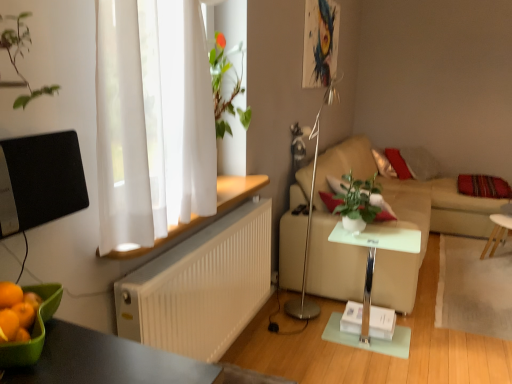
The width and height of the screenshot is (512, 384). What do you see at coordinates (359, 202) in the screenshot?
I see `green glossy houseplant at center` at bounding box center [359, 202].

Image resolution: width=512 pixels, height=384 pixels. What are the coordinates of `white wood window sill at lower left` in the screenshot? It's located at (237, 190).

The image size is (512, 384). Identify the location of green glossy houseplant at center. (359, 202).

Is beige fabric couch at right to the left or to the right of white ribbed radiator at lower left in the image?

beige fabric couch at right is positioned on white ribbed radiator at lower left's right side.

From the image's perspective, who appears lower, beige fabric couch at right or white ribbed radiator at lower left?

From the image's view, white ribbed radiator at lower left is below.

Considering the relative sizes of beige fabric couch at right and white ribbed radiator at lower left in the image provided, is beige fabric couch at right shorter than white ribbed radiator at lower left?

No.

Can we say beige fabric couch at right lies outside white ribbed radiator at lower left?

Yes, beige fabric couch at right is not within white ribbed radiator at lower left.

Is striped fabric pillow at right thinner than white glossy side table at center, marked as the 2th table in a right-to-left arrangement?

No.

Who is more distant, striped fabric pillow at right or white glossy side table at center, marked as the 2th table in a back-to-front arrangement?

Positioned behind is striped fabric pillow at right.

Is striped fabric pillow at right bigger or smaller than white glossy side table at center, marked as the 1th table in a front-to-back arrangement?

Considering their sizes, striped fabric pillow at right takes up less space than white glossy side table at center, marked as the 1th table in a front-to-back arrangement.

Considering the positions of objects green glossy houseplant at center and silver metallic floor lamp at center in the image provided, who is in front, green glossy houseplant at center or silver metallic floor lamp at center?

Positioned in front is silver metallic floor lamp at center.

The width and height of the screenshot is (512, 384). I want to click on lamp in front of the green glossy houseplant at center, so (x=311, y=216).

Considering the relative sizes of green glossy houseplant at center and silver metallic floor lamp at center in the image provided, is green glossy houseplant at center smaller than silver metallic floor lamp at center?

Correct, green glossy houseplant at center occupies less space than silver metallic floor lamp at center.

Looking at this image, is green glossy houseplant at center facing away from silver metallic floor lamp at center?

Yes, green glossy houseplant at center is facing away from silver metallic floor lamp at center.

Who is smaller, green glossy houseplant at center or beige fabric couch at right?

Smaller between the two is green glossy houseplant at center.

Does green glossy houseplant at center have a greater width compared to beige fabric couch at right?

Incorrect, the width of green glossy houseplant at center does not surpass that of beige fabric couch at right.

From a real-world perspective, is green glossy houseplant at center located higher than beige fabric couch at right?

Yes.

Is green glossy houseplant at center facing away from beige fabric couch at right?

No, green glossy houseplant at center's orientation is not away from beige fabric couch at right.

Looking at this image, from the image's perspective, is beige fabric couch at right located above or below green glossy houseplant at center?

From the image's perspective, beige fabric couch at right appears below green glossy houseplant at center.

Would you say beige fabric couch at right is inside or outside green glossy houseplant at center?

beige fabric couch at right is located beyond the bounds of green glossy houseplant at center.

Between beige fabric couch at right and green glossy houseplant at center, which one has more height?

With more height is beige fabric couch at right.

Is beige fabric couch at right not close to green glossy houseplant at center?

They are positioned close to each other.

Between white wooden table at right, the second table positioned from the front, and white glossy side table at center, marked as the 2th table in a back-to-front arrangement, which one has smaller size?

With smaller size is white wooden table at right, the second table positioned from the front.

From the image's perspective, which one is positioned lower, white wooden table at right, which ranks as the 1th table in right-to-left order, or white glossy side table at center, marked as the 2th table in a right-to-left arrangement?

white glossy side table at center, marked as the 2th table in a right-to-left arrangement, is shown below in the image.

In terms of width, does white wooden table at right, which ranks as the 1th table in right-to-left order, look wider or thinner when compared to white glossy side table at center, marked as the 2th table in a back-to-front arrangement?

In the image, white wooden table at right, which ranks as the 1th table in right-to-left order, appears to be more narrow than white glossy side table at center, marked as the 2th table in a back-to-front arrangement.

I want to click on table above the white wooden table at right, which ranks as the 1th table in right-to-left order (from a real-world perspective), so click(372, 278).

Is silver metallic floor lamp at center inside or outside of green glossy houseplant at center?

silver metallic floor lamp at center lies outside green glossy houseplant at center.

Is silver metallic floor lamp at center touching green glossy houseplant at center?

silver metallic floor lamp at center and green glossy houseplant at center are clearly separated.

Could you tell me if silver metallic floor lamp at center is turned towards green glossy houseplant at center?

Yes, silver metallic floor lamp at center is aimed at green glossy houseplant at center.

Locate an element on the screen. This screenshot has width=512, height=384. radiator in front of the beige fabric couch at right is located at coordinates (201, 287).

From a real-world perspective, count 1st tables downward from the striped fabric pillow at right and point to it. Please provide its 2D coordinates.

[(372, 278)]

Considering their positions, is beige fabric couch at right positioned further to white wooden table at right, the second table positioned from the front, than white wood window sill at lower left?

white wood window sill at lower left.

Looking at the image, which one is located closer to silver metallic floor lamp at center, white wooden table at right, which ranks as the 1th table in right-to-left order, or white ribbed radiator at lower left?

white ribbed radiator at lower left lies closer to silver metallic floor lamp at center than the other object.

Looking at the image, which one is located closer to green glossy houseplant at center, white wooden table at right, which ranks as the 1th table in right-to-left order, or beige fabric couch at right?

Among the two, beige fabric couch at right is located nearer to green glossy houseplant at center.

Looking at this image, when comparing their distances from silver metallic floor lamp at center, does white wood window sill at lower left or white ribbed radiator at lower left seem closer?

white ribbed radiator at lower left is closer to silver metallic floor lamp at center.

In the scene shown: From the image, which object appears to be nearer to striped fabric pillow at right, white wooden table at right, which ranks as the first table in back-to-front order, or silver metallic floor lamp at center?

white wooden table at right, which ranks as the first table in back-to-front order, is positioned closer to the anchor striped fabric pillow at right.

Looking at the image, which one is located further to white wood window sill at lower left, white wooden table at right, the second table positioned from the front, or striped fabric pillow at right?

Based on the image, striped fabric pillow at right appears to be further to white wood window sill at lower left.

When comparing their distances from white ribbed radiator at lower left, does green glossy houseplant at center or striped fabric pillow at right seem closer?

The object closer to white ribbed radiator at lower left is green glossy houseplant at center.

From the image, which object appears to be nearer to green glossy houseplant at center, striped fabric pillow at right or white wooden table at right, the 2th table from the left?

The object closer to green glossy houseplant at center is white wooden table at right, the 2th table from the left.

The height and width of the screenshot is (384, 512). What are the coordinates of `table between white wood window sill at lower left and beige fabric couch at right from left to right` in the screenshot? It's located at (372, 278).

You are a GUI agent. You are given a task and a screenshot of the screen. Output one action in this format:
    pyautogui.click(x=<x>, y=<y>)
    Task: Click on the table between green glossy houseplant at center and white wooden table at right, the second table positioned from the front, from left to right
    
    Given the screenshot: What is the action you would take?
    pyautogui.click(x=372, y=278)

The width and height of the screenshot is (512, 384). Identify the location of studio couch situated between white wood window sill at lower left and white wooden table at right, the 2th table from the left, from left to right. (424, 231).

The height and width of the screenshot is (384, 512). In order to click on radiator situated between white wood window sill at lower left and striped fabric pillow at right from left to right in this screenshot , I will do `click(201, 287)`.